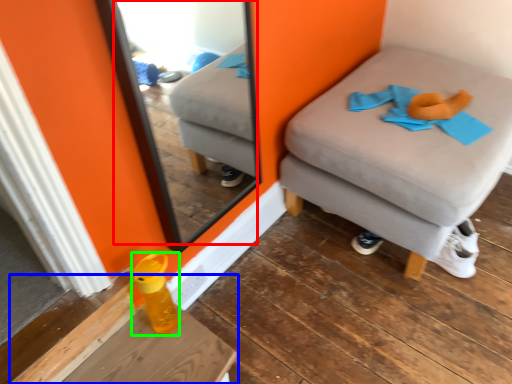
Question: Which object is positioned closest to mirror (highlighted by a red box)? Select from table (highlighted by a blue box) and bottle (highlighted by a green box).

Choices:
 (A) table
 (B) bottle

Answer: (A)